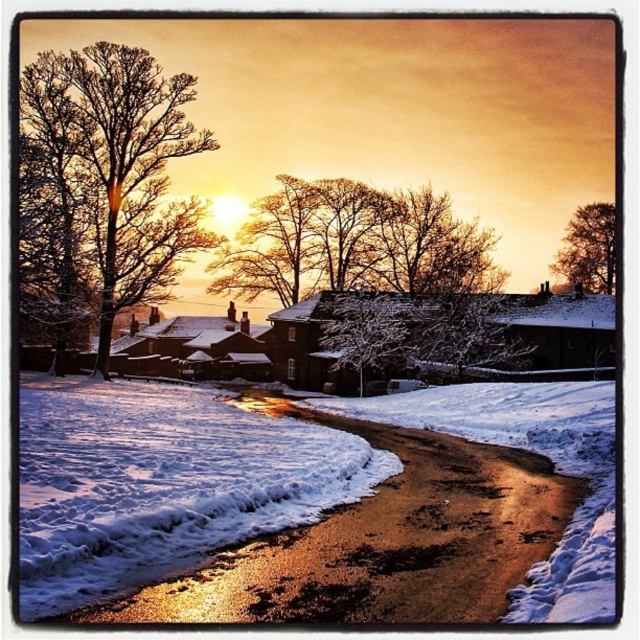
Between white fluffy snow at lower center and brown textured tree at upper right, which one has more height?

Standing taller between the two is brown textured tree at upper right.

Does white fluffy snow at lower center appear on the left side of brown textured tree at upper right?

Yes, white fluffy snow at lower center is to the left of brown textured tree at upper right.

In order to click on white fluffy snow at lower center in this screenshot , I will do `click(163, 483)`.

Where is `brown textured tree at upper right`? The height and width of the screenshot is (640, 640). brown textured tree at upper right is located at coordinates (588, 250).

Locate an element on the screen. brown textured tree at upper right is located at coordinates (588, 250).

Who is positioned more to the right, bare branches at left or white snow-covered tree at center?

white snow-covered tree at center

Does bare branches at left appear over white snow-covered tree at center?

Yes.

The width and height of the screenshot is (640, 640). Identify the location of bare branches at left. (112, 180).